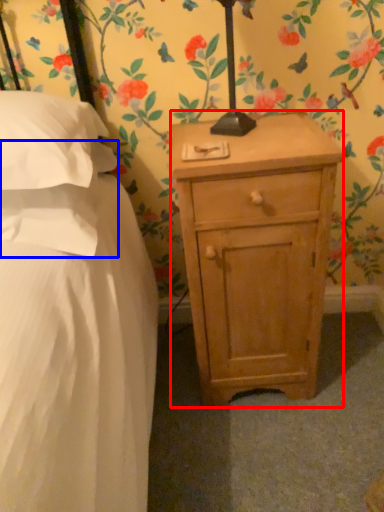
Question: Which of the following is the closest to the observer, nightstand (highlighted by a red box) or pillow (highlighted by a blue box)?

Choices:
 (A) nightstand
 (B) pillow

Answer: (B)